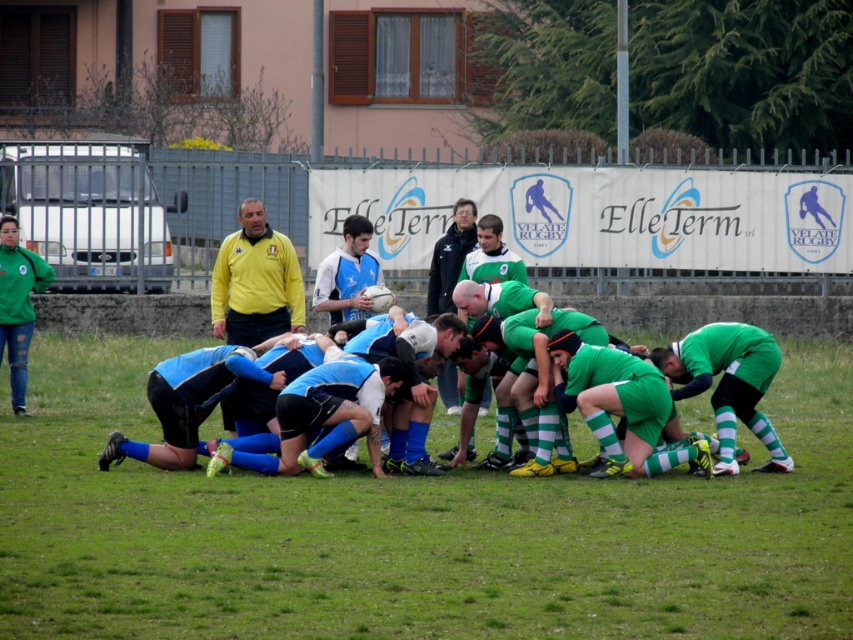
You are a spectator at the rugby match and want to take a photo of both the yellow jersey at center and the dark blue jersey at center. Which jersey should you zoom in on to ensure both are in frame without moving your camera?

The yellow jersey at center might be wider than dark blue jersey at center, so you should zoom in on the yellow jersey at center to ensure both are in frame.